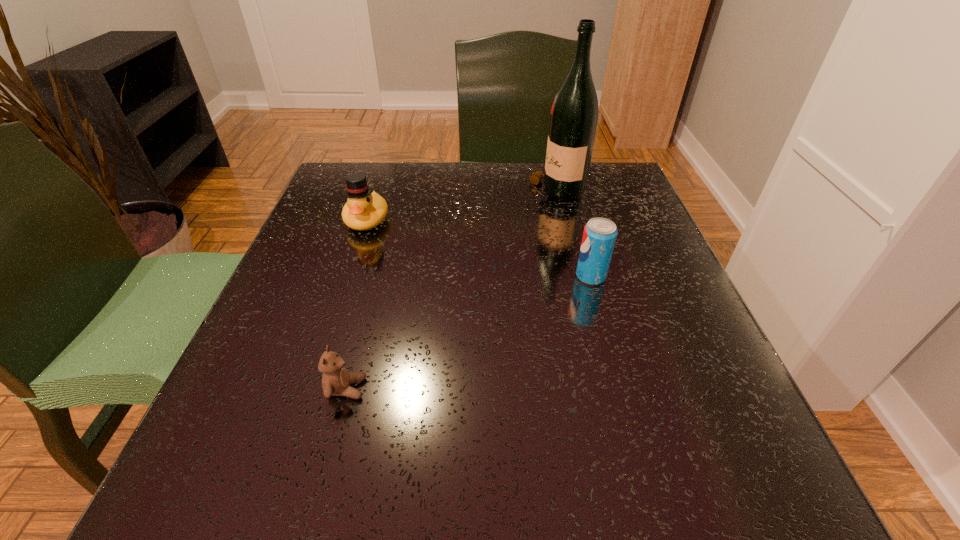
This screenshot has height=540, width=960. In order to click on vacant space located 0.280m on the front-facing side of the shortest object in this screenshot , I will do `click(558, 388)`.

At what (x,y) coordinates should I click in order to perform the action: click on wine bottle positioned at the far edge. Please return your answer as a coordinate pair (x, y). This screenshot has height=540, width=960. Looking at the image, I should click on (574, 115).

The width and height of the screenshot is (960, 540). Identify the location of duck at the far edge. (364, 209).

Find the location of `duck that is positioned at the left edge`. duck that is positioned at the left edge is located at coordinates (364, 209).

Find the location of a particular element. This screenshot has width=960, height=540. teddy bear located at the left edge is located at coordinates (336, 380).

Where is `wine bottle located in the right edge section of the desktop`? This screenshot has height=540, width=960. wine bottle located in the right edge section of the desktop is located at coordinates (574, 115).

Find the location of `soda can present at the right edge`. soda can present at the right edge is located at coordinates (599, 236).

Locate an element on the screen. The height and width of the screenshot is (540, 960). object that is positioned at the far left corner is located at coordinates (364, 209).

Identify the location of object that is at the far right corner. This screenshot has width=960, height=540. (574, 115).

This screenshot has height=540, width=960. Find the location of `vacant space at the far edge of the desktop`. vacant space at the far edge of the desktop is located at coordinates (486, 194).